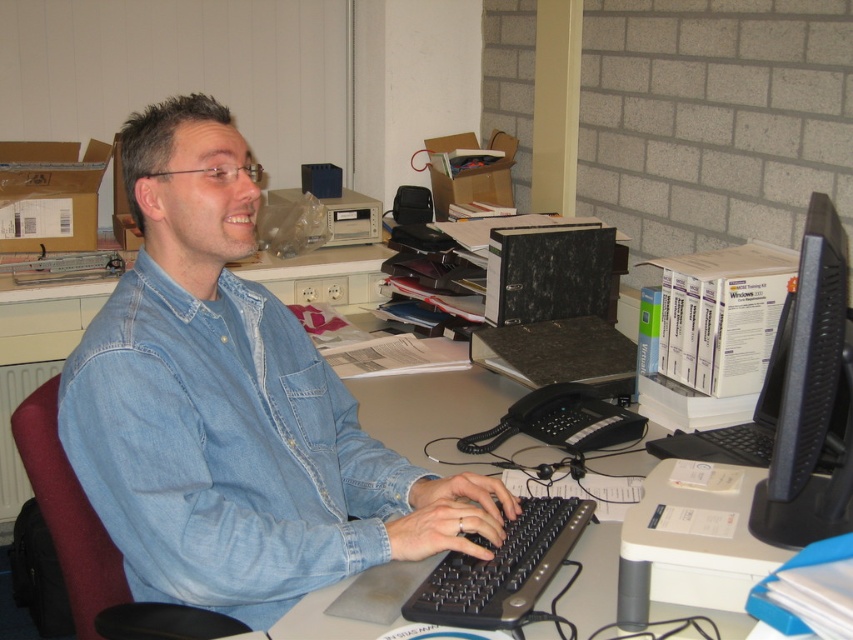
Question: Can you confirm if denim shirt at center is smaller than black plastic monitor at right?

Choices:
 (A) yes
 (B) no

Answer: (B)

Question: Which object is closer to the camera taking this photo?

Choices:
 (A) black plastic keyboard at center
 (B) black plastic monitor at right

Answer: (B)

Question: Is black plastic monitor at right further to camera compared to black plastic keyboard at center?

Choices:
 (A) yes
 (B) no

Answer: (B)

Question: Estimate the real-world distances between objects in this image. Which object is closer to the black plastic monitor at right?

Choices:
 (A) denim shirt at center
 (B) black plastic keyboard at center

Answer: (B)

Question: Which point appears farthest from the camera in this image?

Choices:
 (A) (831, 216)
 (B) (131, 323)

Answer: (B)

Question: Does denim shirt at center have a greater width compared to black plastic keyboard at center?

Choices:
 (A) yes
 (B) no

Answer: (A)